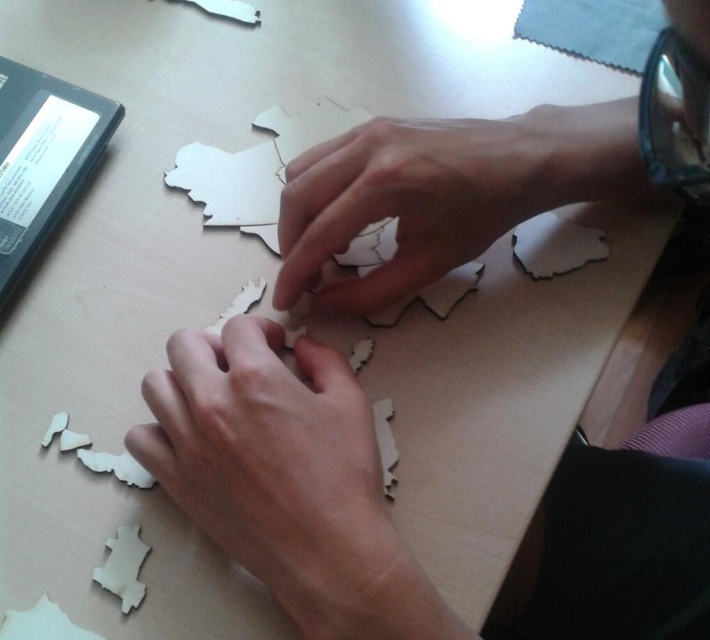
You are a robot observing the scene. You need to determine which object is closer to you between the matte wood hand at center and the wooden puzzle piece at center. Which one is closer?

The matte wood hand at center is closer to the viewer than the wooden puzzle piece at center.

Based on the scene description, where is the matte wood hand located in relation to the point marked at coordinates (273, 467)?

The point at coordinates (273, 467) marks the location of the matte wood hand at center.

Where is the matte wood hand at center located in the image?

The matte wood hand at center is located at point [273,467] in the image.